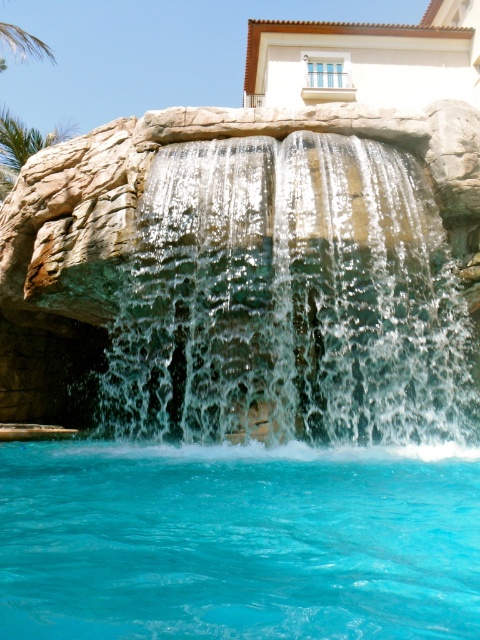
You are a landscape architect designing a new water feature. You have two elements to consider in your design plan. Which of the two elements, the clear water cascade at center or the turquoise glossy water at lower center, has a larger size?

The clear water cascade at center is bigger than the turquoise glossy water at lower center, so the clear water cascade at center has a larger size.

In the scene shown: You are standing at the edge of the pool and want to walk towards the building in the background. Which object will you pass first, the clear water cascade at center or the turquoise glossy water at lower center?

You will pass the clear water cascade at center first because it is closer to you than the turquoise glossy water at lower center, which is further away.

You are standing at the edge of the turquoise glossy water at lower center and want to observe the clear water cascade at center. In which direction should you look relative to your position?

You should look upward because the clear water cascade at center is located above the turquoise glossy water at lower center.